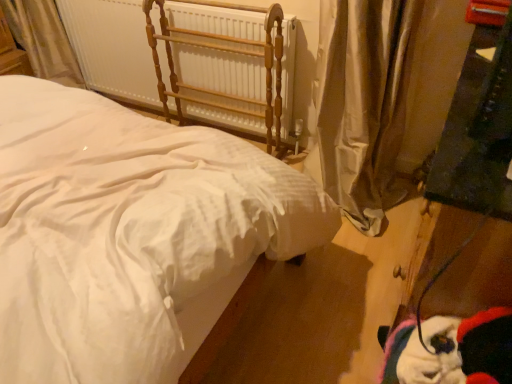
At what (x,y) coordinates should I click in order to perform the action: click on white cotton bed at center. Please return your answer as a coordinate pair (x, y). The image size is (512, 384). Looking at the image, I should click on pos(126,231).

The height and width of the screenshot is (384, 512). In order to click on white painted metal radiator at upper center in this screenshot , I will do `click(187, 59)`.

Where is `silky beige curtain at right`? silky beige curtain at right is located at coordinates (362, 105).

Is silky beige curtain at right outside of white painted metal radiator at upper center?

Yes.

Can you confirm if silky beige curtain at right is bigger than white painted metal radiator at upper center?

Correct, silky beige curtain at right is larger in size than white painted metal radiator at upper center.

Is silky beige curtain at right thinner than white painted metal radiator at upper center?

No, silky beige curtain at right is not thinner than white painted metal radiator at upper center.

Looking at this image, which point is more forward, [355,31] or [96,88]?

Positioned in front is point [355,31].

Can you confirm if white cotton bed at center is positioned to the left of white painted metal radiator at upper center?

Correct, you'll find white cotton bed at center to the left of white painted metal radiator at upper center.

Are white cotton bed at center and white painted metal radiator at upper center far apart?

They are positioned close to each other.

Could you tell me if white cotton bed at center is facing white painted metal radiator at upper center?

No, white cotton bed at center is not turned towards white painted metal radiator at upper center.

Who is smaller, white cotton bed at center or white painted metal radiator at upper center?

white painted metal radiator at upper center is smaller.

From a real-world perspective, is silky beige curtain at right positioned under white cotton bed at center based on gravity?

Actually, silky beige curtain at right is physically above white cotton bed at center in the real world.

Can you confirm if silky beige curtain at right is thinner than white cotton bed at center?

Yes, silky beige curtain at right is thinner than white cotton bed at center.

Is point (341, 146) less distant than point (79, 370)?

That is False.

Consider the image. From the image's perspective, between silky beige curtain at right and white cotton bed at center, who is located below?

From the image's view, white cotton bed at center is below.

Is white painted metal radiator at upper center placed right next to silky beige curtain at right?

No, white painted metal radiator at upper center is not making contact with silky beige curtain at right.

Considering the points (178, 92) and (337, 5), which point is in front, point (178, 92) or point (337, 5)?

The point (337, 5) is closer to the camera.

Is silky beige curtain at right at the back of white painted metal radiator at upper center?

No, white painted metal radiator at upper center is not facing away from silky beige curtain at right.

From the image's perspective, is white painted metal radiator at upper center above silky beige curtain at right?

Yes, from the image's perspective, white painted metal radiator at upper center is on top of silky beige curtain at right.

Which object is positioned more to the left, white painted metal radiator at upper center or white cotton bed at center?

white cotton bed at center is more to the left.

Would you say white painted metal radiator at upper center is inside or outside white cotton bed at center?

white painted metal radiator at upper center is located beyond the bounds of white cotton bed at center.

From the image's perspective, which object appears higher, white painted metal radiator at upper center or white cotton bed at center?

white painted metal radiator at upper center is shown above in the image.

Is point (276, 93) closer or farther from the camera than point (86, 380)?

Point (276, 93) is farther from the camera than point (86, 380).

Is white cotton bed at center situated inside silky beige curtain at right or outside?

white cotton bed at center is outside silky beige curtain at right.

From the image's perspective, which one is positioned higher, white cotton bed at center or silky beige curtain at right?

silky beige curtain at right appears higher in the image.

Identify the location of curtain above the white painted metal radiator at upper center (from a real-world perspective). (362, 105).

I want to click on radiator located underneath the white cotton bed at center (from a real-world perspective), so point(187,59).

From the image, which object appears to be farther from white painted metal radiator at upper center, silky beige curtain at right or white cotton bed at center?

white cotton bed at center lies further to white painted metal radiator at upper center than the other object.

When comparing their distances from white painted metal radiator at upper center, does white cotton bed at center or silky beige curtain at right seem closer?

Based on the image, silky beige curtain at right appears to be nearer to white painted metal radiator at upper center.

From the image, which object appears to be nearer to silky beige curtain at right, white cotton bed at center or white painted metal radiator at upper center?

white painted metal radiator at upper center is positioned closer to the anchor silky beige curtain at right.

Estimate the real-world distances between objects in this image. Which object is further from silky beige curtain at right, white painted metal radiator at upper center or white cotton bed at center?

Based on the image, white cotton bed at center appears to be further to silky beige curtain at right.

From the image, which object appears to be farther from white cotton bed at center, silky beige curtain at right or white painted metal radiator at upper center?

Among the two, white painted metal radiator at upper center is located further to white cotton bed at center.

When comparing their distances from white cotton bed at center, does white painted metal radiator at upper center or silky beige curtain at right seem further?

The object further to white cotton bed at center is white painted metal radiator at upper center.

The height and width of the screenshot is (384, 512). Find the location of `curtain between white cotton bed at center and white painted metal radiator at upper center in the front-back direction`. curtain between white cotton bed at center and white painted metal radiator at upper center in the front-back direction is located at coordinates (362, 105).